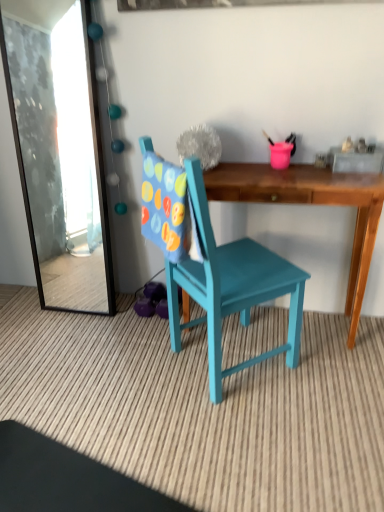
Question: Could wooden desk at center be considered to be inside teal painted wood chair at center?

Choices:
 (A) no
 (B) yes

Answer: (A)

Question: Can you confirm if teal painted wood chair at center is bigger than wooden desk at center?

Choices:
 (A) yes
 (B) no

Answer: (A)

Question: Does teal painted wood chair at center have a lesser height compared to wooden desk at center?

Choices:
 (A) no
 (B) yes

Answer: (A)

Question: From a real-world perspective, is teal painted wood chair at center below wooden desk at center?

Choices:
 (A) yes
 (B) no

Answer: (B)

Question: Is teal painted wood chair at center to the left of wooden desk at center from the viewer's perspective?

Choices:
 (A) yes
 (B) no

Answer: (A)

Question: Is teal painted wood chair at center next to wooden desk at center and touching it?

Choices:
 (A) yes
 (B) no

Answer: (B)

Question: Does wooden desk at center lie in front of transparent glass mirror at upper left?

Choices:
 (A) no
 (B) yes

Answer: (B)

Question: Is wooden desk at center not near transparent glass mirror at upper left?

Choices:
 (A) no
 (B) yes

Answer: (B)

Question: Is wooden desk at center turned away from transparent glass mirror at upper left?

Choices:
 (A) yes
 (B) no

Answer: (B)

Question: From the image's perspective, would you say wooden desk at center is shown under transparent glass mirror at upper left?

Choices:
 (A) yes
 (B) no

Answer: (A)

Question: From a real-world perspective, is wooden desk at center located higher than transparent glass mirror at upper left?

Choices:
 (A) no
 (B) yes

Answer: (A)

Question: Is wooden desk at center taller than transparent glass mirror at upper left?

Choices:
 (A) yes
 (B) no

Answer: (B)

Question: From the image's perspective, is transparent glass mirror at upper left on teal painted wood chair at center?

Choices:
 (A) yes
 (B) no

Answer: (A)